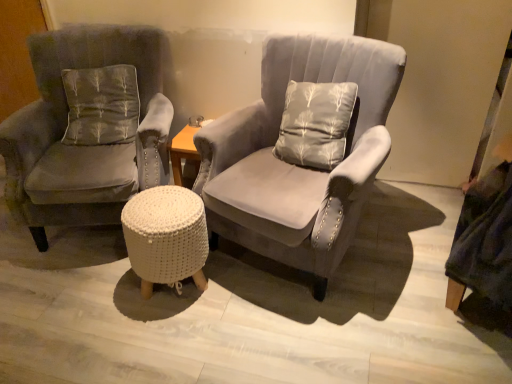
This screenshot has width=512, height=384. What are the coordinates of `vacant space situated above white knitted stool at center (from a real-world perspective)` in the screenshot? It's located at (159, 202).